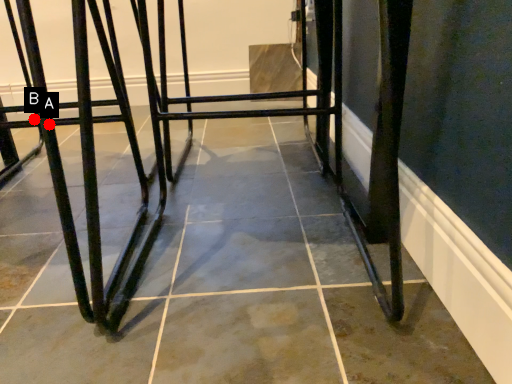
Question: Two points are circled on the image, labeled by A and B beside each circle. Which point appears farthest from the camera in this image?

Choices:
 (A) A is further
 (B) B is further

Answer: (B)